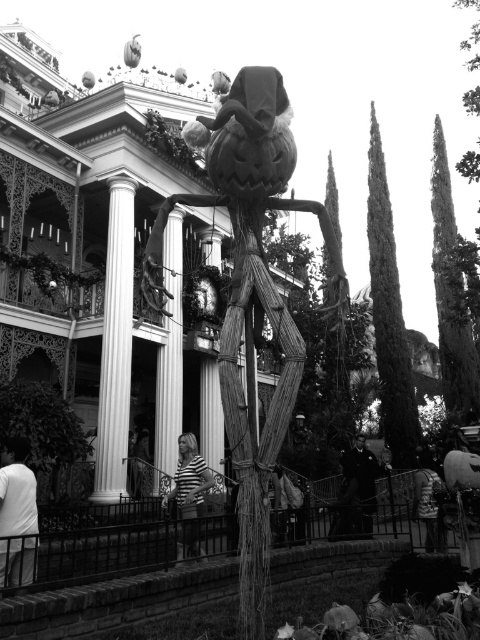
Does wooden pumpkin at center have a smaller size compared to white fabric at lower left?

Actually, wooden pumpkin at center might be larger than white fabric at lower left.

Is wooden pumpkin at center below white fabric at lower left?

No, wooden pumpkin at center is not below white fabric at lower left.

Identify the location of wooden pumpkin at center. Image resolution: width=480 pixels, height=640 pixels. (251, 300).

Which is in front, point (260, 438) or point (357, 465)?

Positioned in front is point (260, 438).

Who is lower down, wooden pumpkin at center or smooth black suit at center?

Positioned lower is smooth black suit at center.

Identify the location of wooden pumpkin at center. The height and width of the screenshot is (640, 480). (251, 300).

Is white fabric at lower left to the right of smooth black suit at center from the viewer's perspective?

In fact, white fabric at lower left is to the left of smooth black suit at center.

Between white fabric at lower left and smooth black suit at center, which one is positioned lower?

smooth black suit at center is lower down.

Which is behind, point (24, 492) or point (345, 470)?

The point (345, 470) is behind.

At what (x,y) coordinates should I click in order to perform the action: click on white fabric at lower left. Please return your answer as a coordinate pair (x, y). This screenshot has width=480, height=640. Looking at the image, I should click on (16, 515).